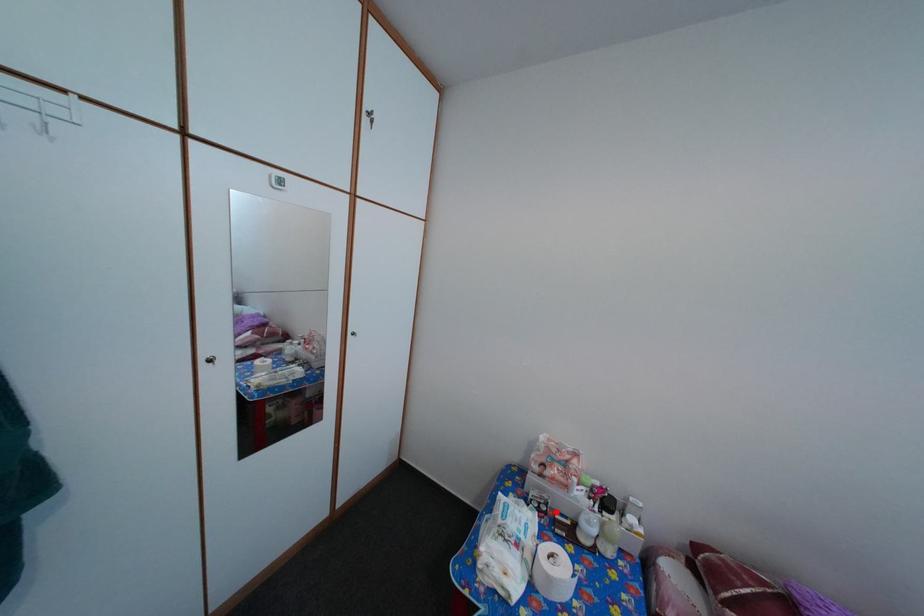
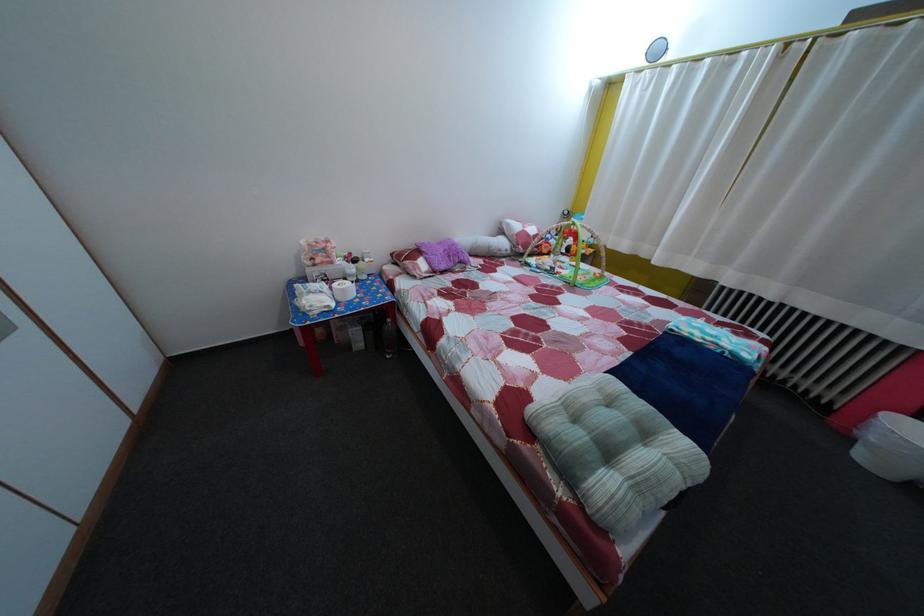
Locate, in the second image, the point that corresponds to the highlighted location in the first image.

(335, 284)